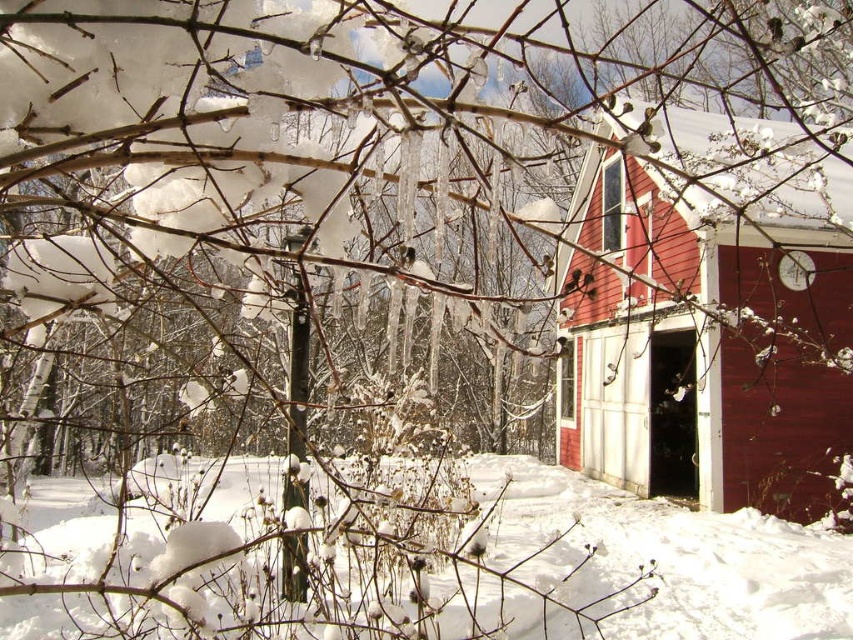
Consider the image. Between smooth red cabin at center and white fluffy snow at lower center, which one has less height?

white fluffy snow at lower center is shorter.

Which is more to the left, smooth red cabin at center or white fluffy snow at lower center?

white fluffy snow at lower center is more to the left.

Which is in front, point (737, 424) or point (755, 592)?

Point (755, 592) is more forward.

Find the location of a particular element. This screenshot has width=853, height=640. smooth red cabin at center is located at coordinates (708, 317).